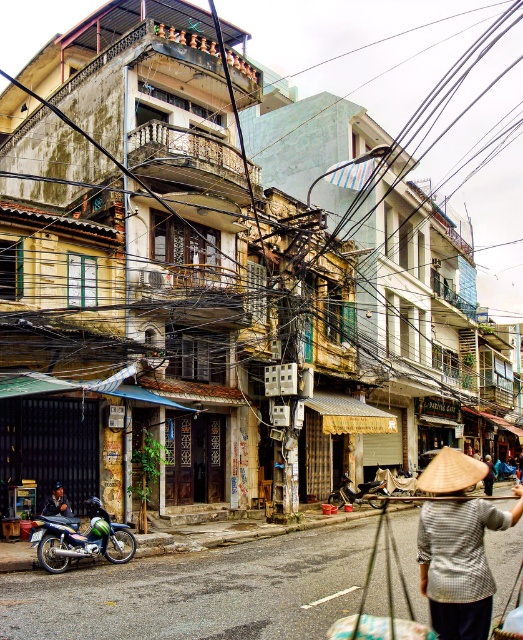
Question: In this image, where is blue metallic motorcycle at center-left located relative to dark blue shirt at center?

Choices:
 (A) left
 (B) right

Answer: (B)

Question: Is blue metallic motorcycle at center-left below green matte motorcycle at center?

Choices:
 (A) no
 (B) yes

Answer: (A)

Question: Is black wire at upper center to the right of checkered fabric conical hat at center from the viewer's perspective?

Choices:
 (A) no
 (B) yes

Answer: (B)

Question: Which of these objects is positioned farthest from the green matte motorcycle at center?

Choices:
 (A) blue metallic motorcycle at center-left
 (B) black wire at upper center

Answer: (B)

Question: Among these points, which one is farthest from the camera?

Choices:
 (A) (335, 497)
 (B) (475, 550)
 (C) (390, 262)

Answer: (C)

Question: Which point is closer to the camera taking this photo?

Choices:
 (A) (471, 458)
 (B) (77, 554)

Answer: (B)